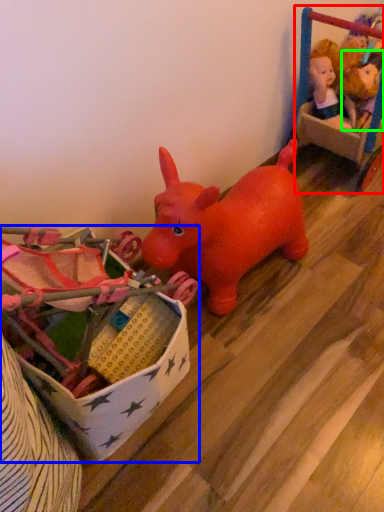
Question: Which object is the farthest from toy (highlighted by a red box)? Choose among these: toy (highlighted by a blue box) or toy (highlighted by a green box).

Choices:
 (A) toy
 (B) toy

Answer: (A)